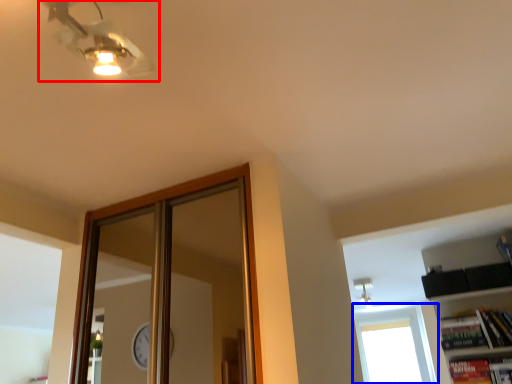
Question: Which of the following is the closest to the observer, fan (highlighted by a red box) or window (highlighted by a blue box)?

Choices:
 (A) fan
 (B) window

Answer: (A)